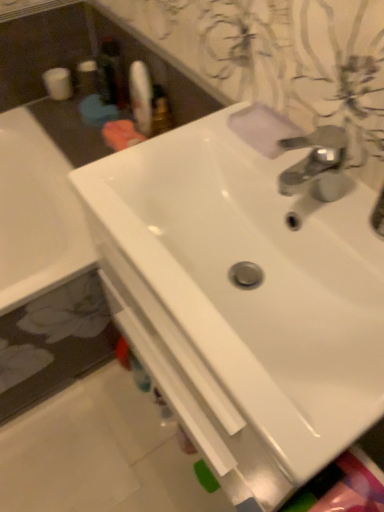
Describe the element at coordinates (258, 281) in the screenshot. Image resolution: width=384 pixels, height=512 pixels. I see `white glossy sink at center` at that location.

Where is `white glossy sink at center`? white glossy sink at center is located at coordinates (258, 281).

Identify the location of white glossy sink at center. (258, 281).